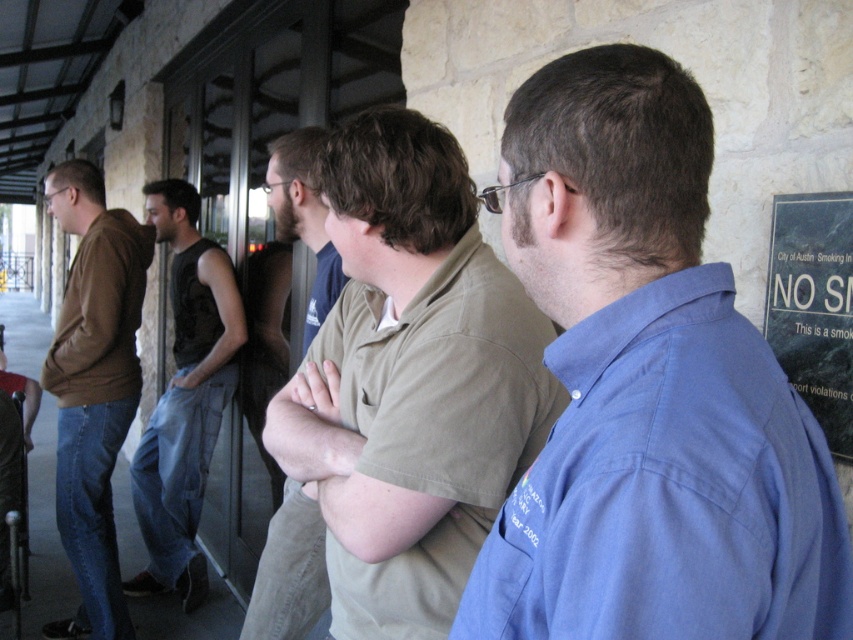
In the scene shown: You are observing a group of people outside a building. You notice two individuals wearing a light brown cotton shirt at center and a dark gray sleeveless shirt at left. Which person is standing closer to the building entrance?

The light brown cotton shirt at center is above the dark gray sleeveless shirt at left, indicating that the person in the light brown cotton shirt at center is positioned closer to the building entrance.

You are standing in front of the NO SMOKING sign on the right side of the building. You notice a person wearing a blue cotton shirt at center who is 21.05 inches away from you. According to safety regulations, you must maintain a distance of at least 24 inches from others. Are you compliant with the regulation?

The blue cotton shirt at center is 21.05 inches away from the viewer, which is less than the required 24 inches. Therefore, you are not compliant with the safety regulation.